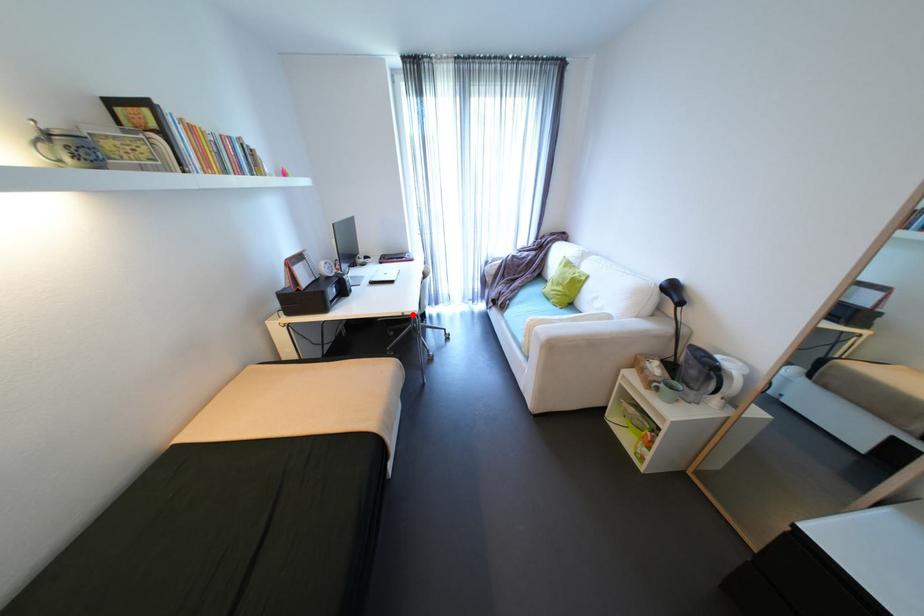
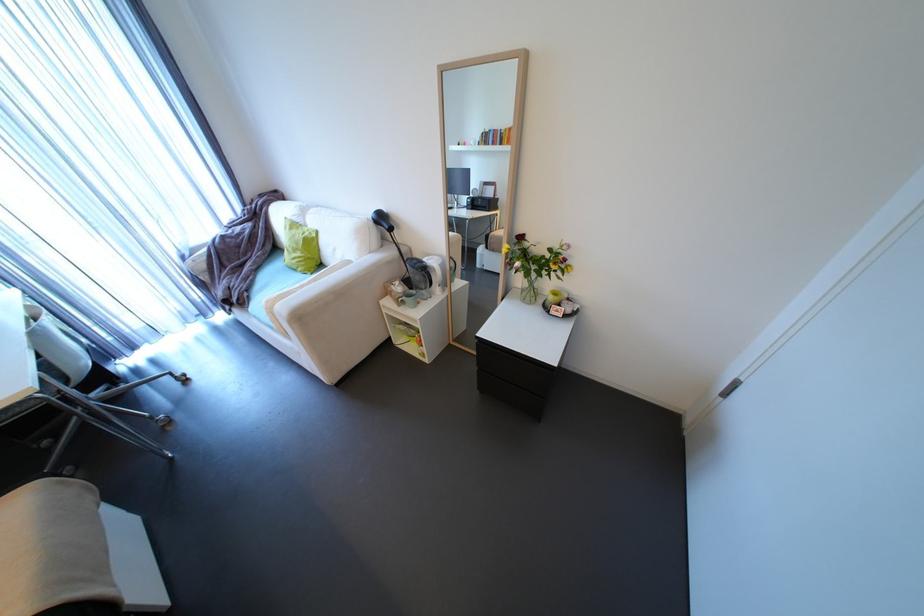
In the second image, find the point that corresponds to the highlighted location in the first image.

(7, 408)